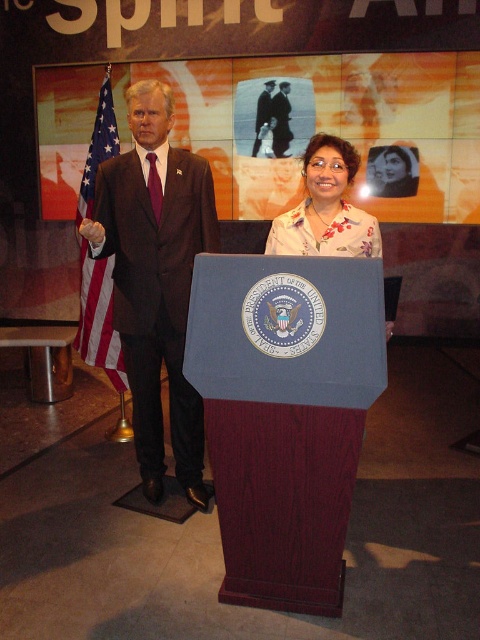
Question: Which object is positioned closest to the red-white-blue fabric flag at left?

Choices:
 (A) dark blue suit at center
 (B) dark suit at center

Answer: (B)

Question: Is red-white-blue fabric flag at left to the right of dark blue suit at center from the viewer's perspective?

Choices:
 (A) yes
 (B) no

Answer: (B)

Question: Does matte brown suit at left have a greater width compared to dark suit at center?

Choices:
 (A) no
 (B) yes

Answer: (B)

Question: Estimate the real-world distances between objects in this image. Which object is farther from the dark blue suit at center?

Choices:
 (A) matte brown suit at left
 (B) red-white-blue fabric flag at left

Answer: (A)

Question: Considering the real-world distances, which object is farthest from the floral fabric blouse at center?

Choices:
 (A) dark blue suit at center
 (B) dark suit at center
 (C) red-white-blue fabric flag at left
 (D) matte brown suit at left

Answer: (B)

Question: Is dark suit at center above dark blue suit at center?

Choices:
 (A) yes
 (B) no

Answer: (A)